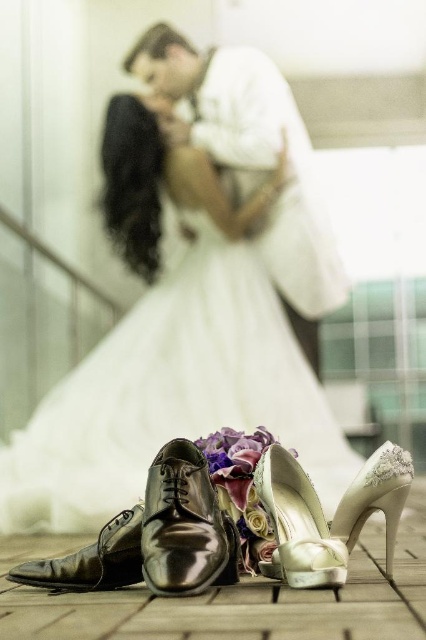
Question: Which of the following is the farthest from the observer?

Choices:
 (A) (117, 541)
 (B) (189, 563)
 (C) (373, 508)

Answer: (C)

Question: Where is shiny black shoe at center located in relation to ivory satin high heel at center in the image?

Choices:
 (A) right
 (B) left

Answer: (B)

Question: Can you confirm if shiny black shoe at center is positioned above ivory satin high heel at center?

Choices:
 (A) no
 (B) yes

Answer: (B)

Question: Where is white satin dress at lower center located in relation to shiny black shoe at lower left in the image?

Choices:
 (A) below
 (B) above

Answer: (B)

Question: Which point is closer to the camera?

Choices:
 (A) shiny black shoe at lower left
 (B) shiny black shoe at center
 (C) ivory satin high heel at center

Answer: (B)

Question: Which of the following is the farthest from the observer?

Choices:
 (A) (103, 561)
 (B) (245, 276)
 (C) (313, 541)
 (D) (371, 490)

Answer: (B)